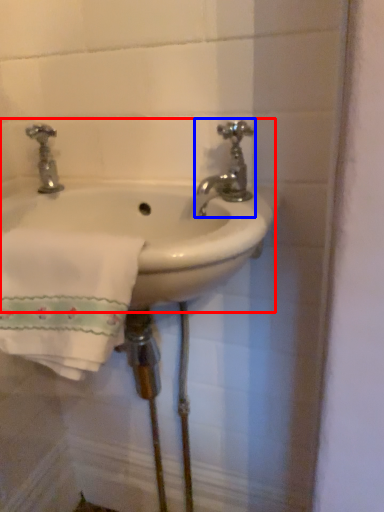
Question: Which point is further to the camera, sink (highlighted by a red box) or tap (highlighted by a blue box)?

Choices:
 (A) sink
 (B) tap

Answer: (B)